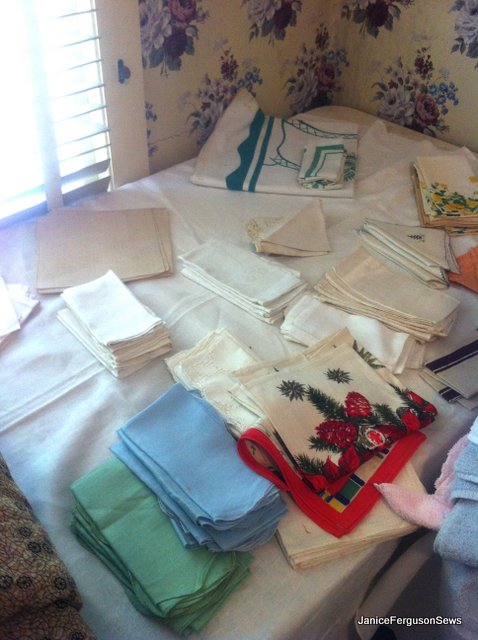
I want to click on hook, so click(122, 70).